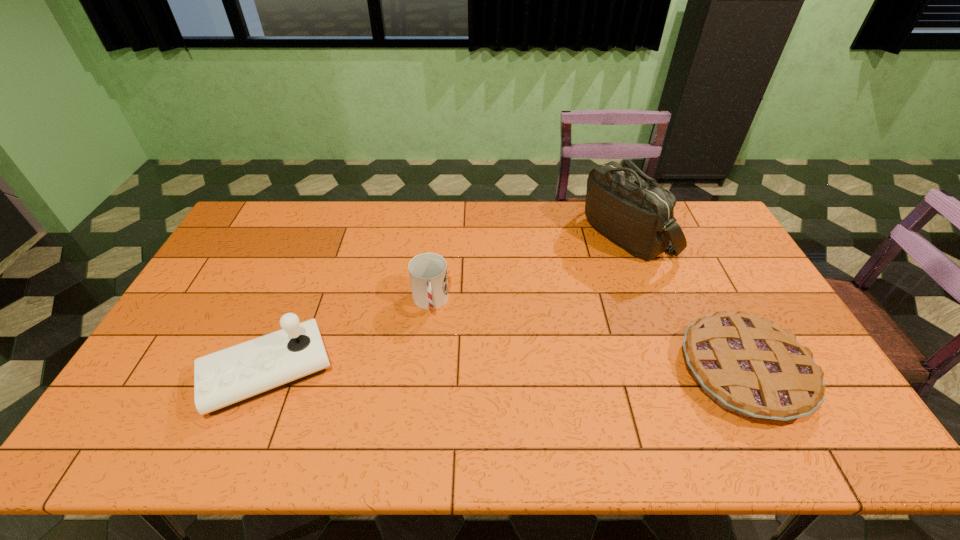
At what (x,y) coordinates should I click in order to perform the action: click on object at the near left corner. Please return your answer as a coordinate pair (x, y). The image size is (960, 540). Looking at the image, I should click on (224, 379).

At what (x,y) coordinates should I click in order to perform the action: click on object that is positioned at the near right corner. Please return your answer as a coordinate pair (x, y). This screenshot has height=540, width=960. Looking at the image, I should click on (748, 365).

The width and height of the screenshot is (960, 540). Find the location of `free space at the far edge`. free space at the far edge is located at coordinates click(311, 205).

Identify the location of vacant space at the near edge of the desktop. The width and height of the screenshot is (960, 540). (494, 398).

Where is `free location at the left edge`? free location at the left edge is located at coordinates (252, 248).

In the image, there is a desktop. Where is `blank space at the right edge`? blank space at the right edge is located at coordinates (729, 270).

This screenshot has width=960, height=540. I want to click on vacant region between the leftmost object and the second shortest object, so click(x=349, y=337).

Locate an element on the screen. Image resolution: width=960 pixels, height=540 pixels. free area in between the third shortest object and the second shortest object is located at coordinates (349, 337).

The height and width of the screenshot is (540, 960). What are the coordinates of `empty space that is in between the second farthest object and the shoulder bag` in the screenshot? It's located at (528, 268).

Image resolution: width=960 pixels, height=540 pixels. Find the location of `free space between the pie and the shoulder bag`. free space between the pie and the shoulder bag is located at coordinates (685, 303).